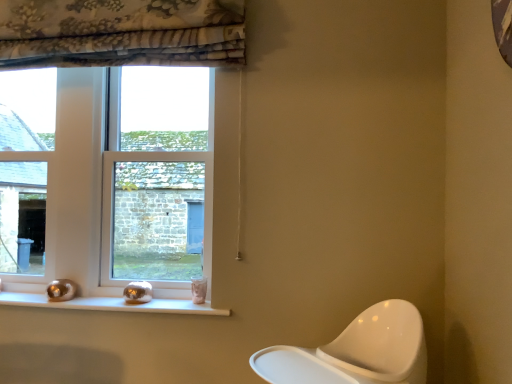
Question: Looking at the image, does clear glass window at left, which is the 1th window from left to right, seem bigger or smaller compared to white glossy window sill at lower center?

Choices:
 (A) big
 (B) small

Answer: (A)

Question: From a real-world perspective, relative to white glossy window sill at lower center, is clear glass window at left, the second window when ordered from right to left, vertically above or below?

Choices:
 (A) above
 (B) below

Answer: (A)

Question: Estimate the real-world distances between objects in this image. Which object is farther from the white glossy window sill at lower center?

Choices:
 (A) clear glass window at left, the second window when ordered from right to left
 (B) clear glass window at center, the second window positioned from the left

Answer: (A)

Question: Estimate the real-world distances between objects in this image. Which object is closer to the clear glass window at left, which is the 1th window from left to right?

Choices:
 (A) white glossy window sill at lower center
 (B) clear glass window at center, the second window positioned from the left

Answer: (B)